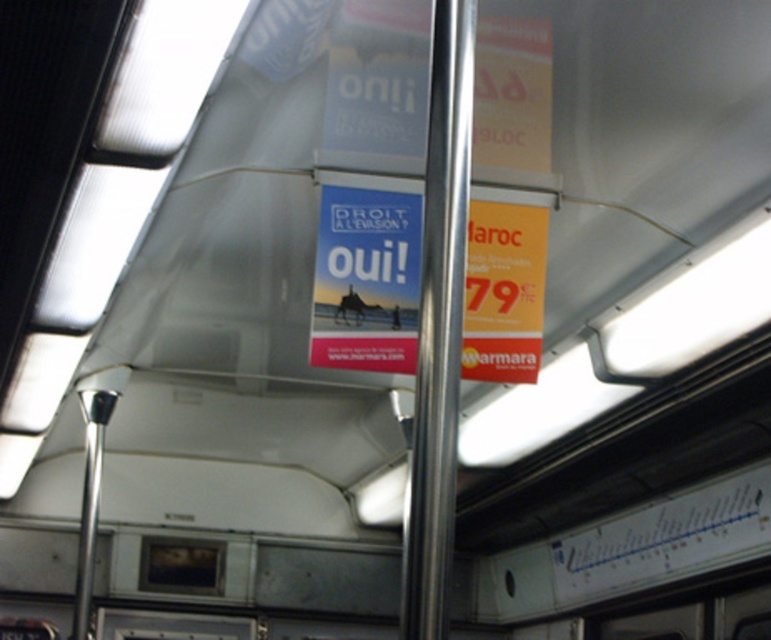
Can you confirm if blue paper sign at center is positioned to the left of polished metal pole at center?

Incorrect, blue paper sign at center is not on the left side of polished metal pole at center.

Is point (367, 202) positioned after point (428, 406)?

That is True.

Identify the location of blue paper sign at center. This screenshot has height=640, width=771. (365, 280).

Find the location of a particular element. The image size is (771, 640). blue paper sign at center is located at coordinates (365, 280).